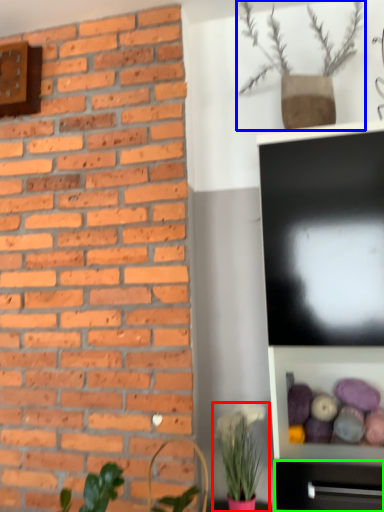
Question: Which is farther away from houseplant (highlighted by a red box)? houseplant (highlighted by a blue box) or tv cabinet (highlighted by a green box)?

Choices:
 (A) houseplant
 (B) tv cabinet

Answer: (A)